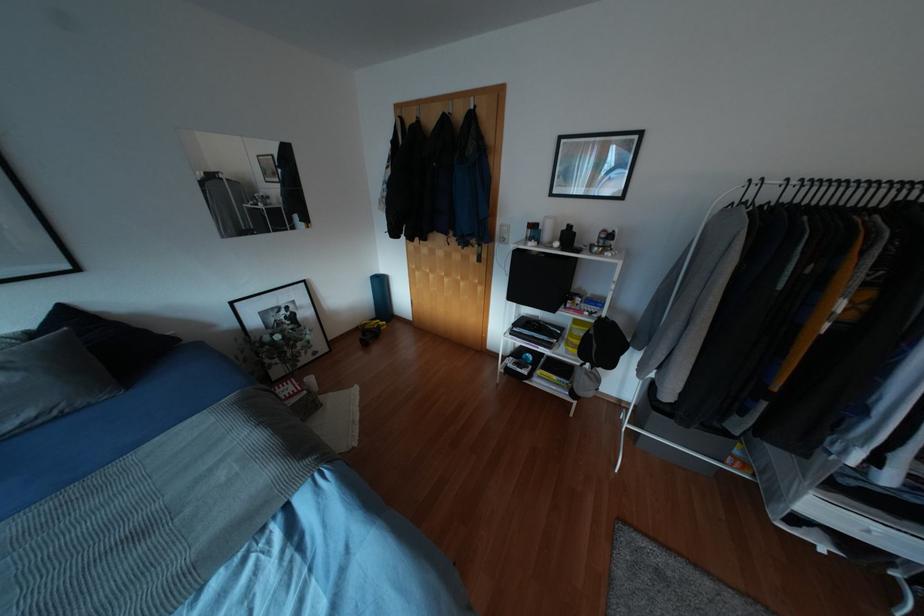
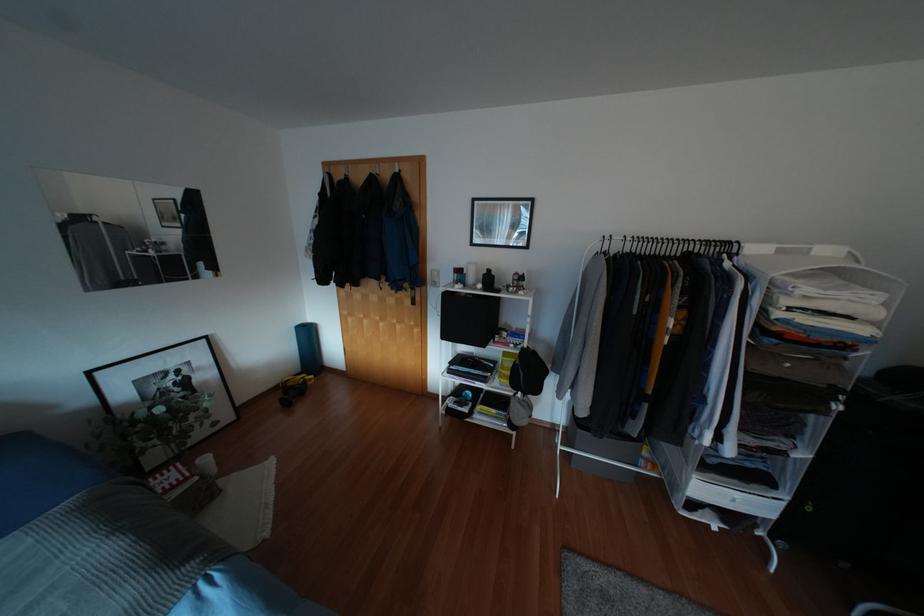
Locate, in the second image, the point that corresponds to (x=562, y=248) in the first image.

(483, 289)